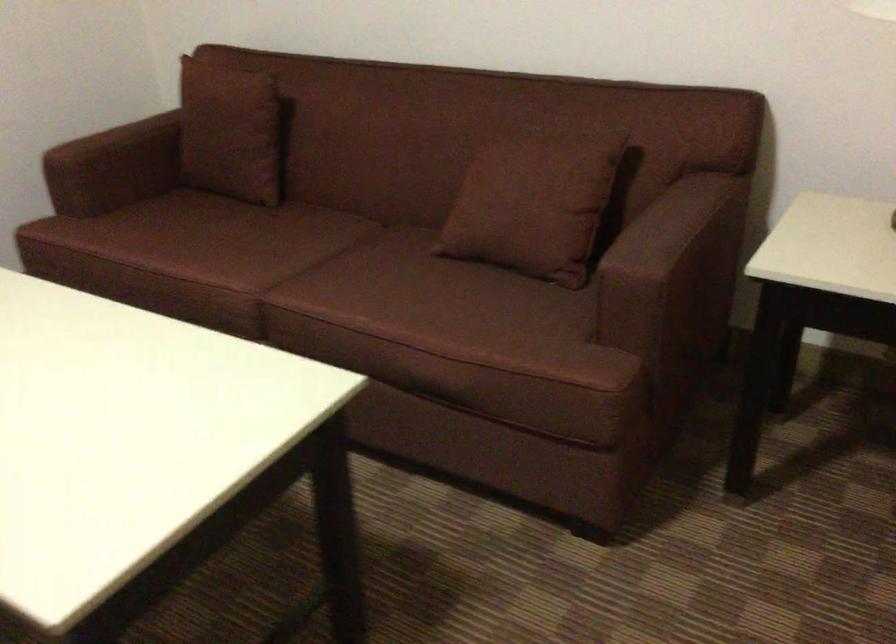
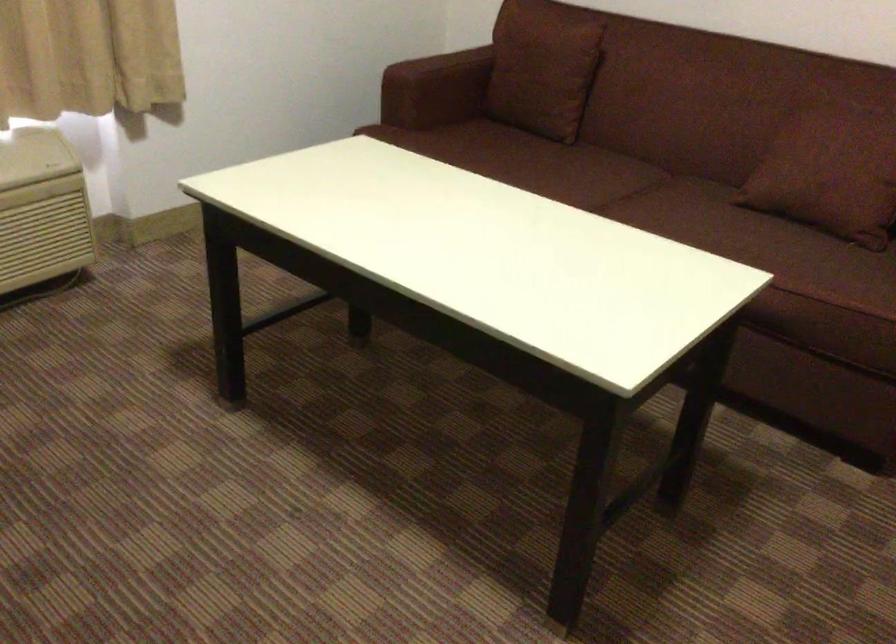
Locate, in the second image, the point that corresponds to point (532, 252) in the first image.

(842, 207)